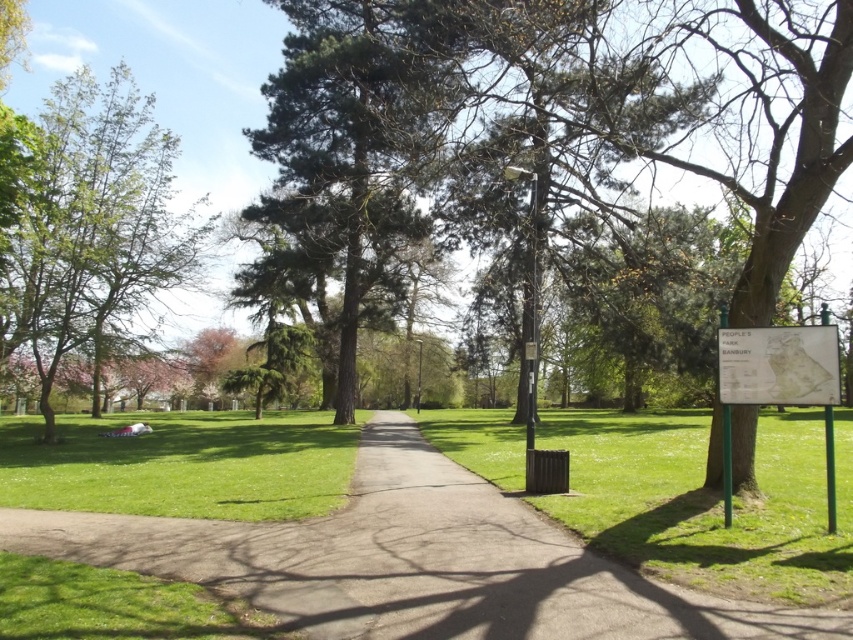
Which of these two, green leafy tree at left or white paper map at right, stands shorter?

Standing shorter between the two is white paper map at right.

Which is above, green leafy tree at left or white paper map at right?

green leafy tree at left

You are a GUI agent. You are given a task and a screenshot of the screen. Output one action in this format:
    pyautogui.click(x=<x>, y=<y>)
    Task: Click on the green leafy tree at left
    This screenshot has width=853, height=640.
    Given the screenshot: What is the action you would take?
    pyautogui.click(x=97, y=230)

Between green leafy tree at left and green grassy at lower left, which one has more height?

Standing taller between the two is green leafy tree at left.

Which is in front, point (54, 96) or point (270, 420)?

Point (54, 96) is more forward.

Is point (120, 282) positioned after point (236, 467)?

Yes, point (120, 282) is behind point (236, 467).

Locate an element on the screen. This screenshot has width=853, height=640. green leafy tree at left is located at coordinates pyautogui.click(x=97, y=230).

The height and width of the screenshot is (640, 853). What are the coordinates of `green grass at center` in the screenshot? It's located at (706, 500).

Locate an element on the screen. The height and width of the screenshot is (640, 853). green grass at center is located at coordinates (706, 500).